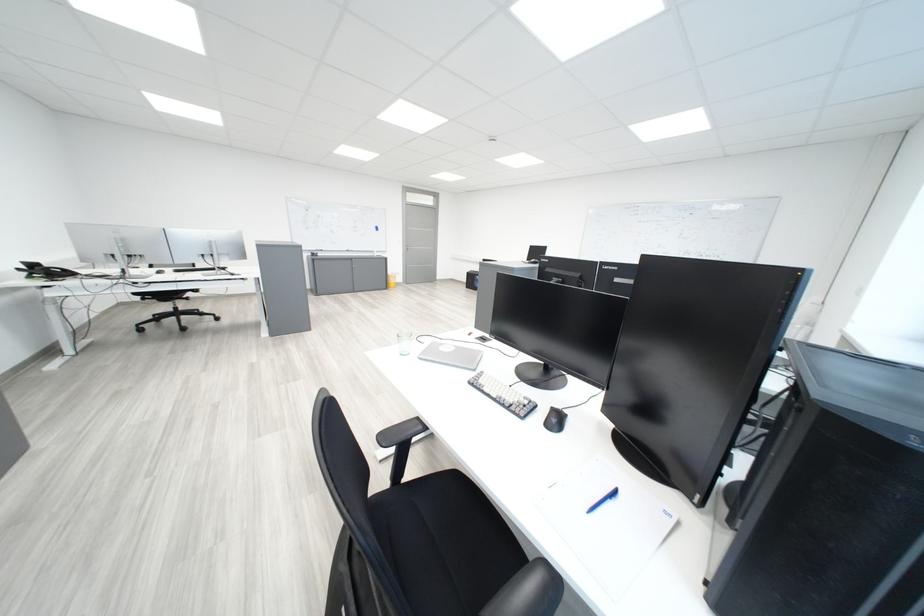
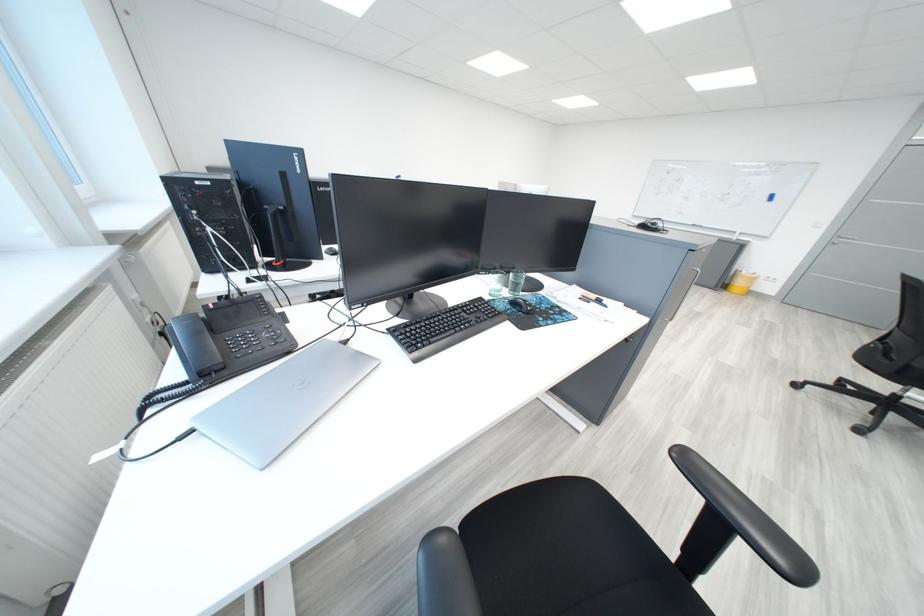
Question: I am providing you with two images of the same scene from different viewpoints. Which of the following objects are not visible in image2?

Choices:
 (A) glass cup
 (B) stacked paper items
 (C) gray cabinet handle
 (D) closed silver laptop

Answer: (D)